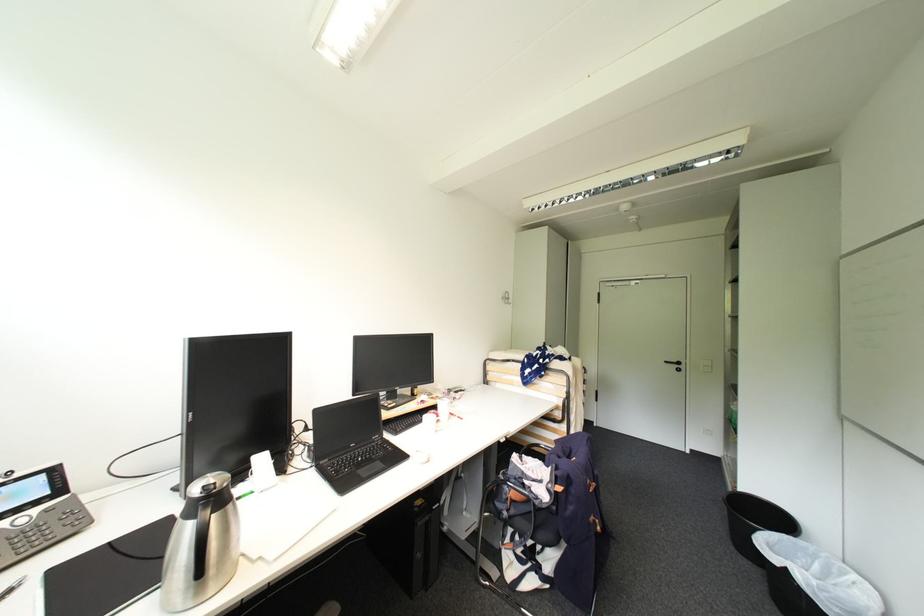
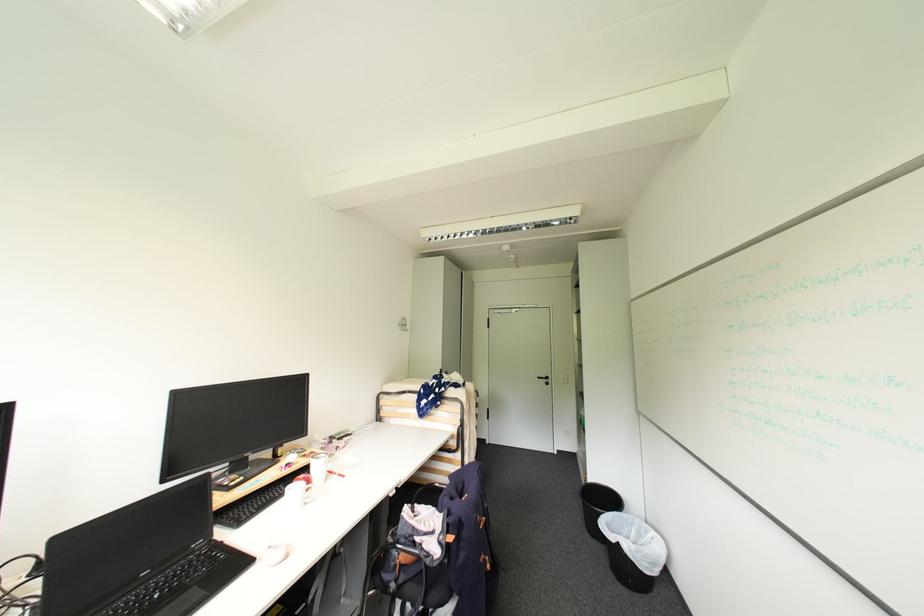
Locate, in the second image, the point that corresponds to pixel 556 485 in the first image.

(447, 538)